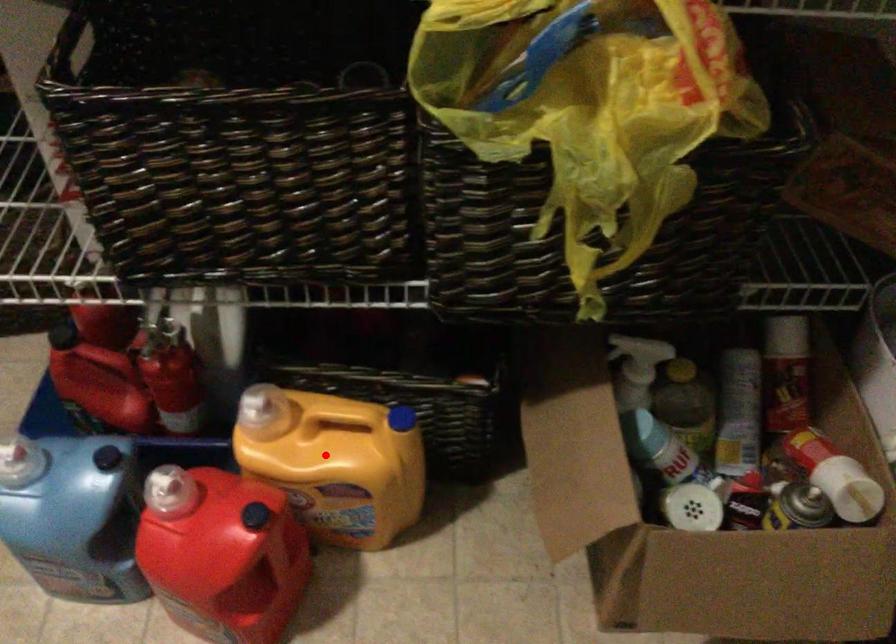
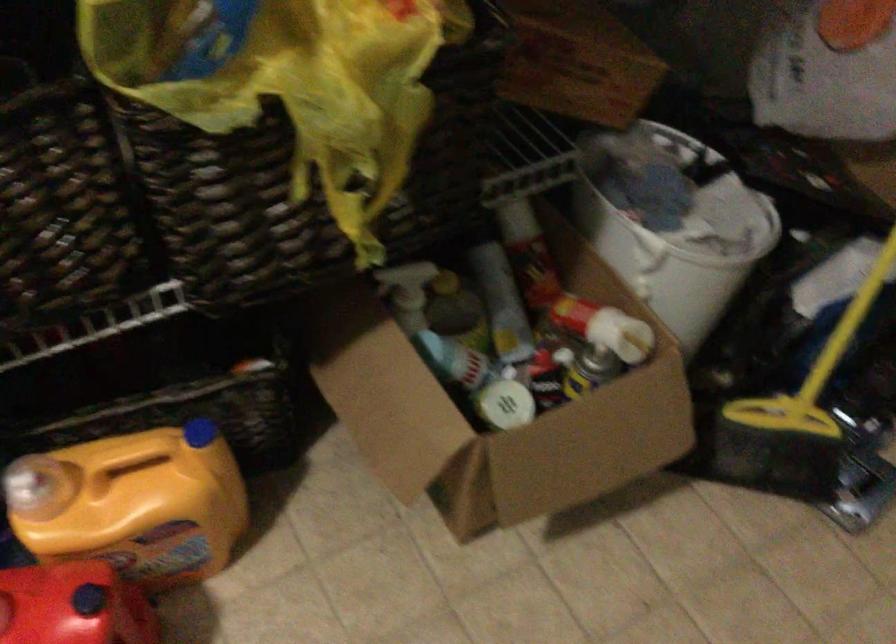
Locate, in the second image, the point that corresponds to the highlighted location in the first image.

(133, 504)